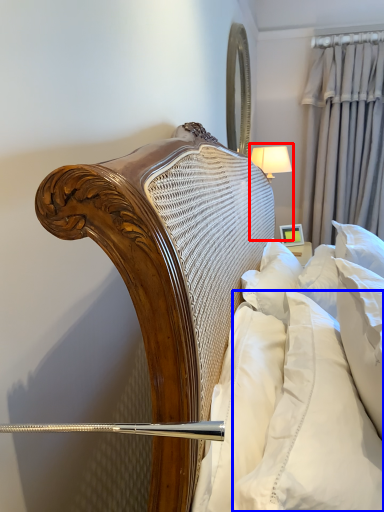
Question: Which of the following is the closest to the observer, bedside lamp (highlighted by a red box) or pillow (highlighted by a blue box)?

Choices:
 (A) bedside lamp
 (B) pillow

Answer: (B)